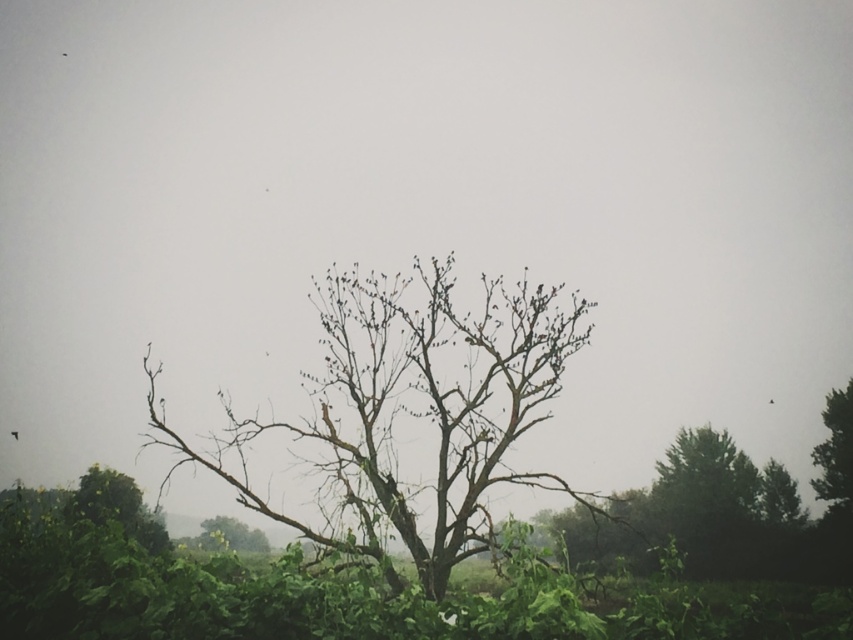
Consider the image. You are standing in the forest and see the green textured tree at right and the green matte tree at lower center. Which tree is closer to you?

The green textured tree at right is closer to you because the green matte tree at lower center is behind it.

You are a bird looking for a nesting spot. You see the green textured tree at right and the green matte tree at lower center. Which tree is shorter and better for nesting?

The green textured tree at right is shorter than the green matte tree at lower center, making it better for nesting.